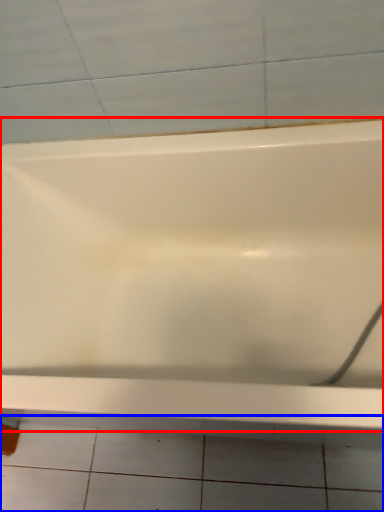
Question: Among these objects, which one is farthest to the camera, bathtub (highlighted by a red box) or ceramic tile (highlighted by a blue box)?

Choices:
 (A) bathtub
 (B) ceramic tile

Answer: (B)